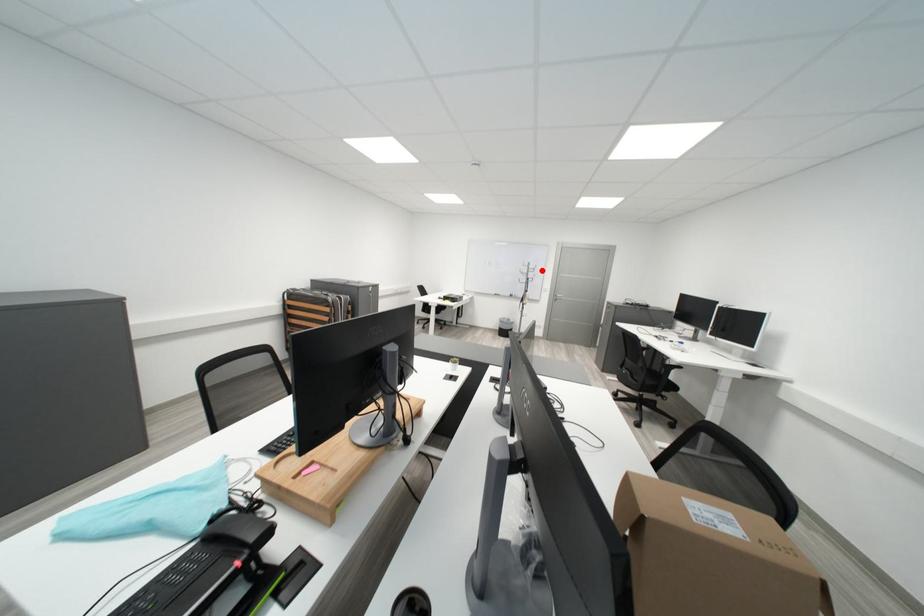
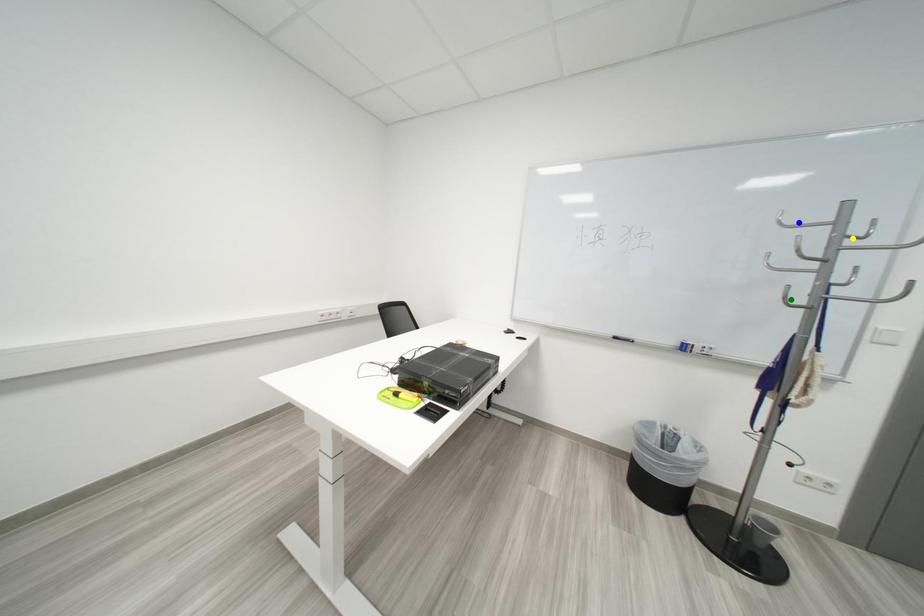
Question: I am providing you with two images of the same scene from different viewpoints. A red point is marked on the first image. You are given multiple points on the second image. Which spot in image 2 lines up with the point in image 1?

Choices:
 (A) blue point
 (B) green point
 (C) yellow point

Answer: (C)